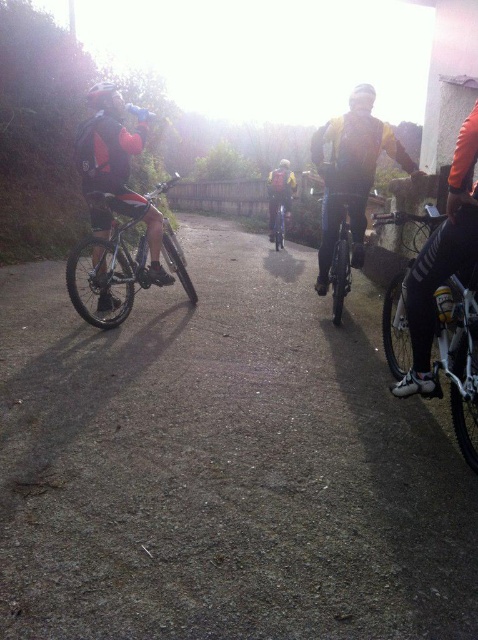
Does shiny silver bicycle at center appear under matte black helmet at upper center?

Indeed, shiny silver bicycle at center is positioned under matte black helmet at upper center.

This screenshot has height=640, width=478. What do you see at coordinates (279, 218) in the screenshot?
I see `shiny silver bicycle at center` at bounding box center [279, 218].

Locate an element on the screen. Image resolution: width=478 pixels, height=640 pixels. shiny silver bicycle at center is located at coordinates (279, 218).

Is point (465, 444) closer to camera compared to point (364, 99)?

Yes, point (465, 444) is in front of point (364, 99).

Is white matte bicycle at lower right closer to the viewer compared to matte black helmet at upper center?

That is True.

Is point (462, 337) farther from camera compared to point (368, 90)?

No, (462, 337) is in front of (368, 90).

Where is `white matte bicycle at lower right`? Image resolution: width=478 pixels, height=640 pixels. white matte bicycle at lower right is located at coordinates (458, 356).

Does shiny metallic bicycle at left lie in front of shiny metallic bicycle at center?

That is True.

The width and height of the screenshot is (478, 640). What do you see at coordinates (115, 259) in the screenshot? I see `shiny metallic bicycle at left` at bounding box center [115, 259].

Which is in front, point (118, 257) or point (341, 301)?

Point (118, 257)

You are a GUI agent. You are given a task and a screenshot of the screen. Output one action in this format:
    pyautogui.click(x=<x>, y=<y>)
    Task: Click on the shiny metallic bicycle at left
    This screenshot has width=478, height=640.
    Given the screenshot: What is the action you would take?
    pyautogui.click(x=115, y=259)